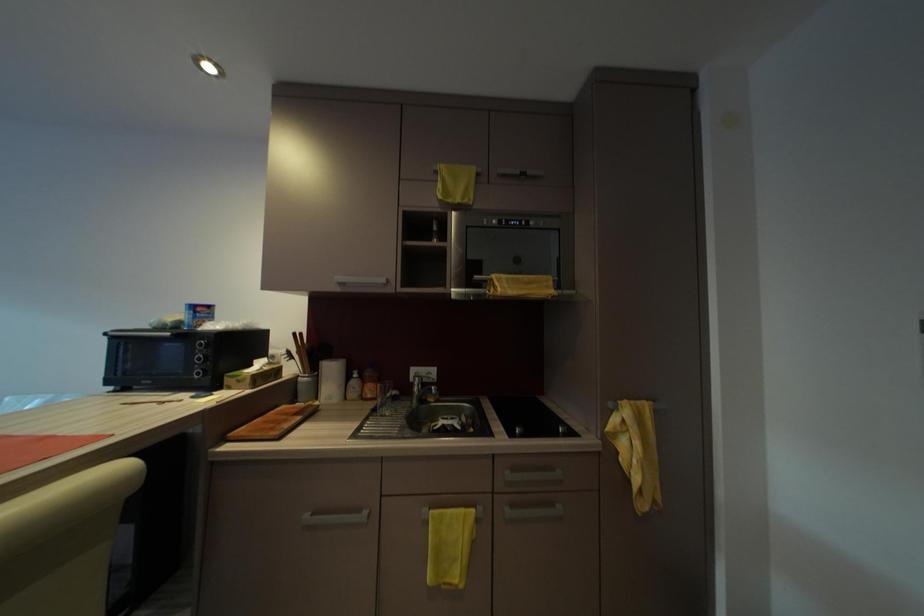
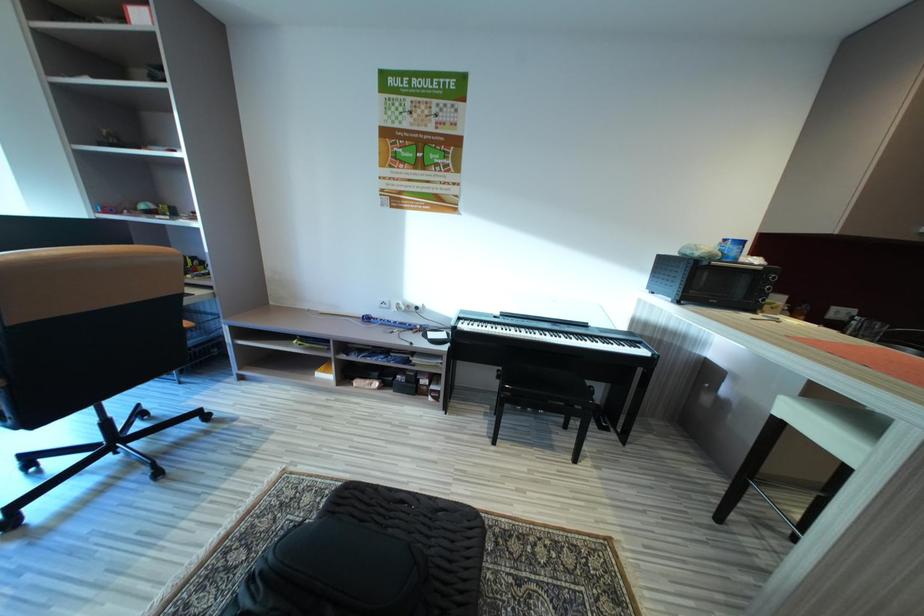
Question: In a continuous first-person perspective shot, in which direction is the camera moving?

Choices:
 (A) Left
 (B) Right
 (C) Forward
 (D) Backward

Answer: (A)